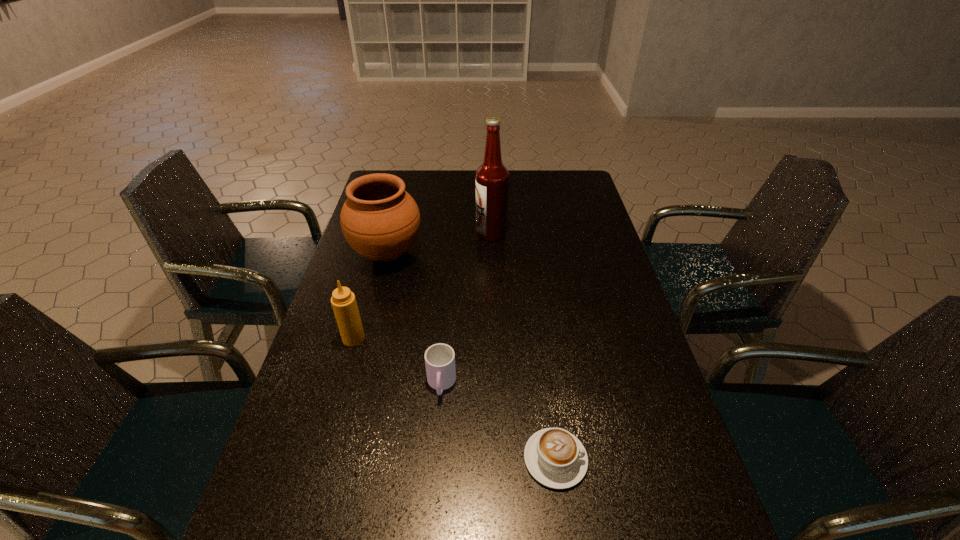
Locate an element on the screen. The width and height of the screenshot is (960, 540). the tallest object is located at coordinates (492, 178).

Where is `alcohol`? alcohol is located at coordinates (492, 178).

The width and height of the screenshot is (960, 540). I want to click on the fourth shortest object, so click(x=381, y=221).

Where is `condiment`? This screenshot has width=960, height=540. condiment is located at coordinates (343, 301).

Locate an element on the screen. This screenshot has width=960, height=540. the third tallest object is located at coordinates (343, 301).

Image resolution: width=960 pixels, height=540 pixels. In order to click on the fourth tallest object in this screenshot , I will do `click(439, 358)`.

At what (x,y) coordinates should I click in order to perform the action: click on the second nearest object. Please return your answer as a coordinate pair (x, y). Looking at the image, I should click on (439, 358).

Find the location of `the rightmost object`. the rightmost object is located at coordinates (555, 458).

Find the location of `the nearest object`. the nearest object is located at coordinates (555, 458).

The height and width of the screenshot is (540, 960). In order to click on vacant region located on the label side of the tallest object in this screenshot , I will do `click(401, 233)`.